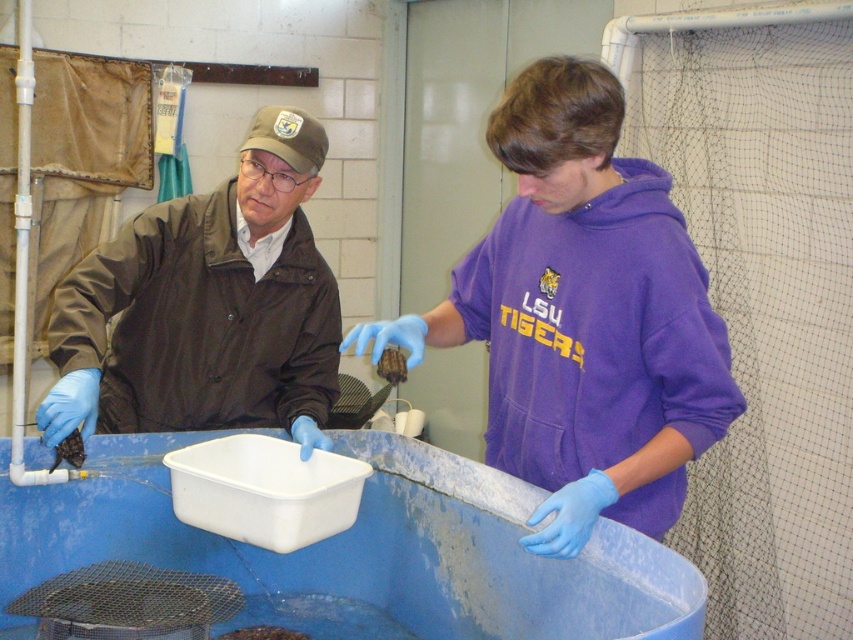
Question: Can you confirm if purple fleece hoodie at center is thinner than brown matte jacket at left?

Choices:
 (A) no
 (B) yes

Answer: (A)

Question: Among these objects, which one is nearest to the camera?

Choices:
 (A) purple fleece hoodie at center
 (B) brown matte jacket at left

Answer: (A)

Question: Which of the following is the closest to the observer?

Choices:
 (A) purple fleece hoodie at center
 (B) brown matte jacket at left

Answer: (A)

Question: Can you confirm if purple fleece hoodie at center is wider than brown matte jacket at left?

Choices:
 (A) yes
 (B) no

Answer: (A)

Question: Can you confirm if purple fleece hoodie at center is positioned to the left of brown matte jacket at left?

Choices:
 (A) yes
 (B) no

Answer: (B)

Question: Among these points, which one is farthest from the camera?

Choices:
 (A) (305, 436)
 (B) (645, 346)

Answer: (A)